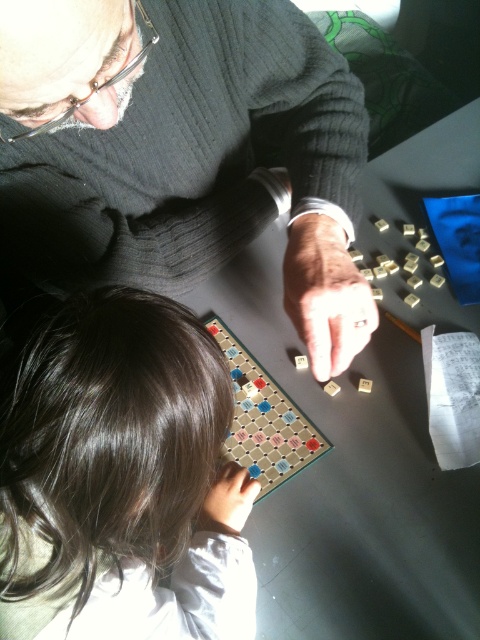
Question: In this image, where is matte black scrabble tiles at center located relative to wooden scrabble board at center?

Choices:
 (A) below
 (B) above

Answer: (B)

Question: Can you confirm if matte black scrabble tiles at center is positioned to the left of wooden scrabble board at center?

Choices:
 (A) no
 (B) yes

Answer: (B)

Question: Which object is farther from the camera taking this photo?

Choices:
 (A) smooth brown hair at lower left
 (B) wooden scrabble board at center
 (C) matte black scrabble tiles at center

Answer: (B)

Question: Among these objects, which one is farthest from the camera?

Choices:
 (A) wooden scrabble board at center
 (B) matte black scrabble tiles at center

Answer: (A)

Question: Is smooth brown hair at lower left below wooden scrabble board at center?

Choices:
 (A) no
 (B) yes

Answer: (B)

Question: Which of the following is the farthest from the observer?

Choices:
 (A) (228, 605)
 (B) (245, 369)

Answer: (B)